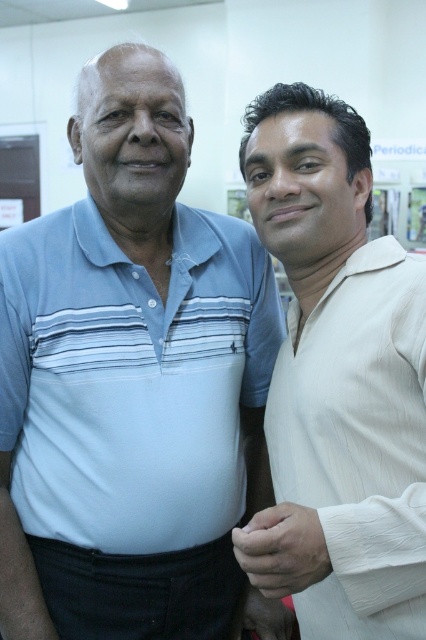
You are standing in the same room as the two individuals in the image. You need to hand a document to the person wearing the light blue striped polo shirt at left. Based on their position in the image, which direction should you walk to reach them?

The light blue striped polo shirt at left is located at point 0.603 on the x and 0.312 on the y coordinates. Since the person is on the left side of the image, you should walk to your left to reach them.

You are a photographer adjusting the framing of a group photo. You notice the light blue striped polo shirt at left and the white silk shirt at right in the frame. Which shirt should you adjust to ensure both shirts appear proportionally sized in the final image?

The light blue striped polo shirt at left is wider than the white silk shirt at right, so you should adjust the light blue striped polo shirt at left to reduce its width or move the person wearing it closer to maintain proportional sizing.